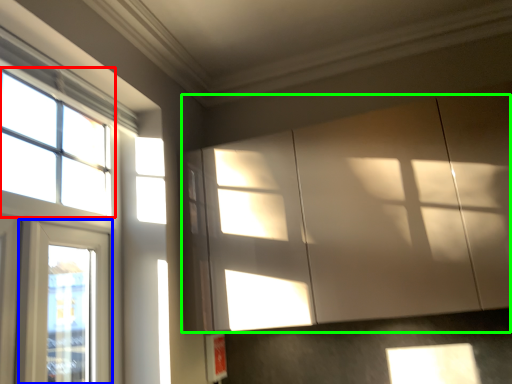
Question: Which object is positioned farthest from window (highlighted by a red box)? Select from window (highlighted by a blue box) and cabinetry (highlighted by a green box).

Choices:
 (A) window
 (B) cabinetry

Answer: (B)